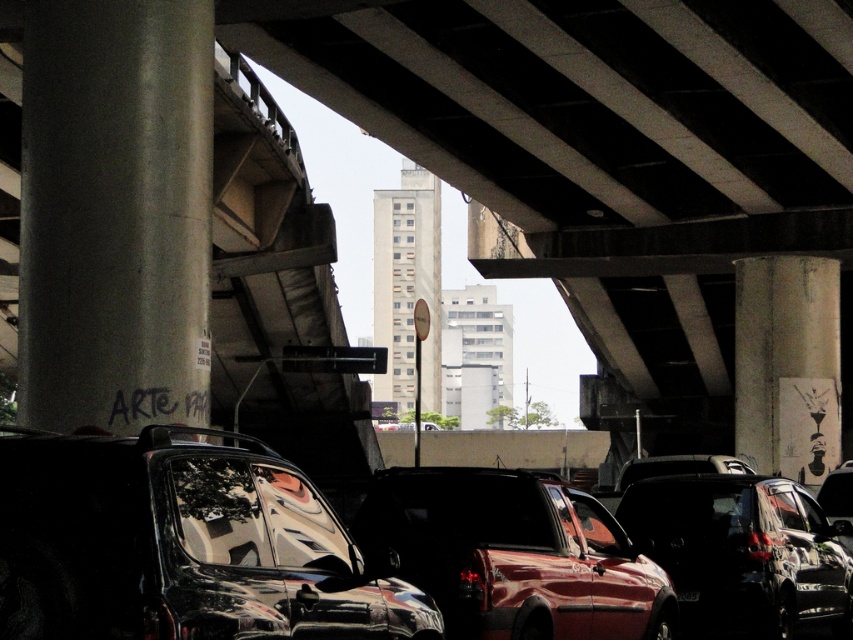
Looking at this image, you are a photographer trying to capture both the shiny metallic truck at center and the glossy metallic car at center under the overpass. Since you want to include both in your photo, which object should you position closer to the camera to ensure both fit in the frame?

Since the shiny metallic truck at center occupies less space than the glossy metallic car at center, you should position the glossy metallic car at center closer to the camera to ensure both fit in the frame.

You are a delivery driver who needs to park your vehicle under the overpass. You see the glossy metallic car at center and the black plastic license plate at center. Which object is positioned to the left when you look at them from the front of the vehicles?

The black plastic license plate at center is positioned to the left because the glossy metallic car at center is to the right of it.

In the scene shown: You are a photographer trying to capture the reflection of the overpass in the glossy metallic car at center. However, the shiny metallic truck at center is blocking your view. Which direction should you move to avoid the truck and still see the car?

Move to the right side of the shiny metallic truck at center so that the glossy metallic car at center becomes visible without obstruction.